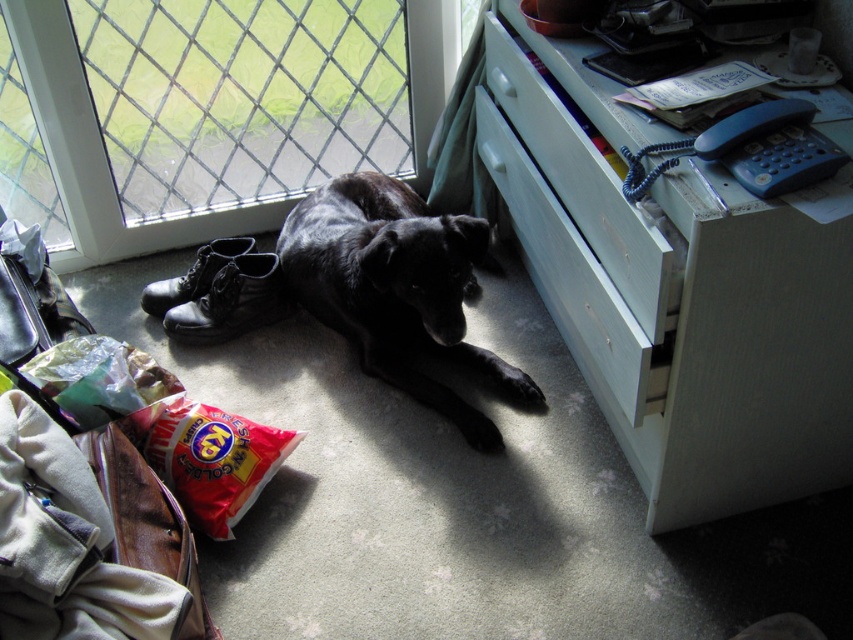
You are organizing the living room and need to move the velvet fabric bag at lower left. To do this, do you need to move the white wood file cabinet at right first?

The white wood file cabinet at right is positioned over the velvet fabric bag at lower left, so you must move the white wood file cabinet at right first to access the velvet fabric bag at lower left.

You are a person who wants to place a new shoe organizer on the wall between the white wood file cabinet at right and the matte black boot at lower left. Which object should you use as a reference point for the organizer height to ensure it is placed at the same level as the taller object?

The white wood file cabinet at right has a greater height compared to the matte black boot at lower left, so you should use the white wood file cabinet at right as the reference point to ensure the shoe organizer is placed at the same level as the taller object.

You are standing in the room and want to pick up an object. Which of the two points, point (553,278) or point (10,396), is closer to you?

Point (553,278) is further to the camera than point (10,396), so the point closer to you is point (10,396).